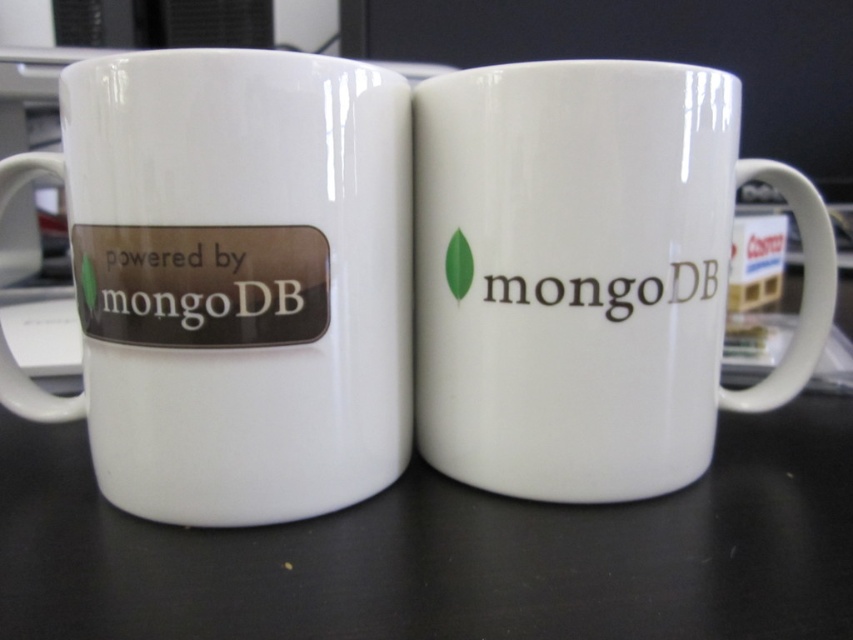
Question: Which point is closer to the camera taking this photo?

Choices:
 (A) click(15, 465)
 (B) click(202, 484)
 (C) click(460, 109)

Answer: (B)

Question: Can you confirm if white ceramic mug at center is positioned below white glossy mug at center?

Choices:
 (A) yes
 (B) no

Answer: (B)

Question: Among these points, which one is nearest to the camera?

Choices:
 (A) (347, 163)
 (B) (392, 547)

Answer: (B)

Question: Is the position of white ceramic mug at center more distant than that of white glossy mug at center?

Choices:
 (A) yes
 (B) no

Answer: (A)

Question: Which object is positioned farthest from the white glossy mug at left?

Choices:
 (A) white glossy mug at center
 (B) white ceramic mug at center

Answer: (A)

Question: Does white glossy mug at left have a lesser width compared to white glossy mug at center?

Choices:
 (A) no
 (B) yes

Answer: (B)